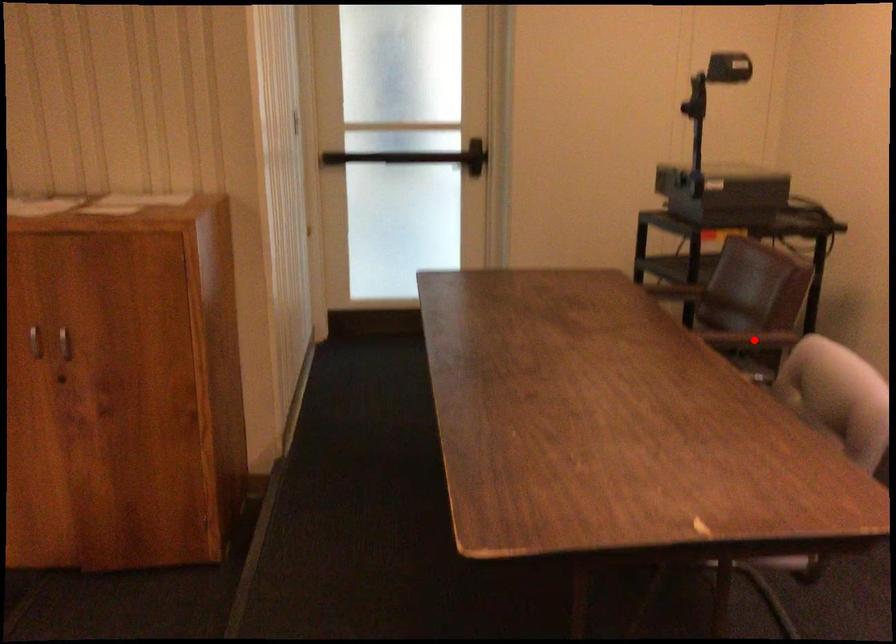
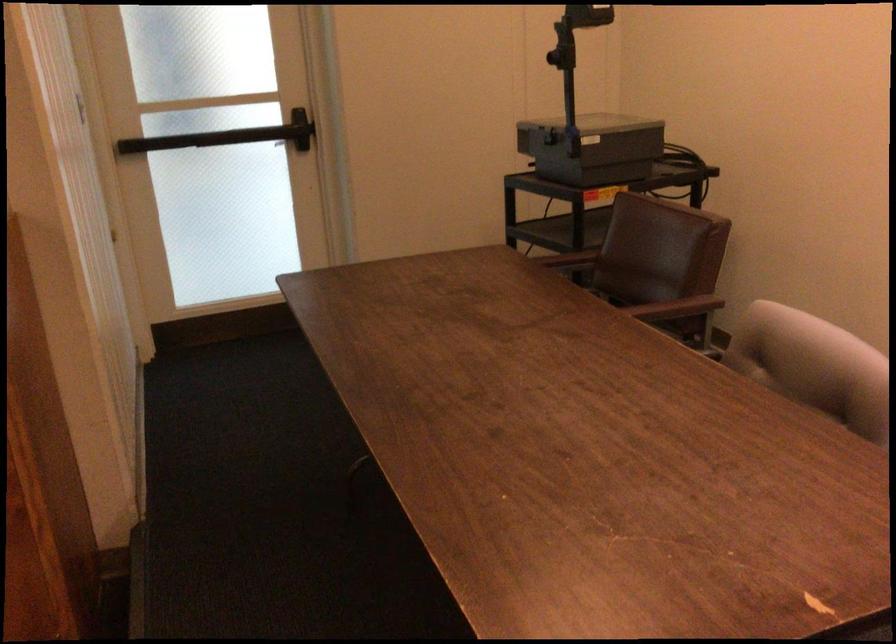
The point at the highlighted location is marked in the first image. Where is the corresponding point in the second image?

(677, 308)